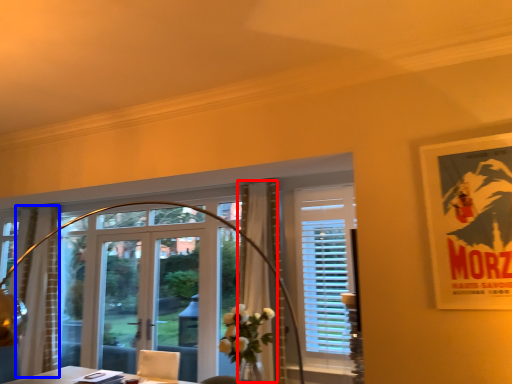
Question: Which object is further to the camera taking this photo, curtain (highlighted by a red box) or curtain (highlighted by a blue box)?

Choices:
 (A) curtain
 (B) curtain

Answer: (B)